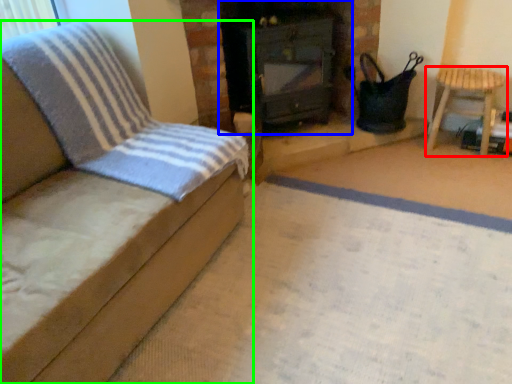
Question: Which is farther away from furniture (highlighted by a red box)? stove (highlighted by a blue box) or furniture (highlighted by a green box)?

Choices:
 (A) stove
 (B) furniture

Answer: (B)